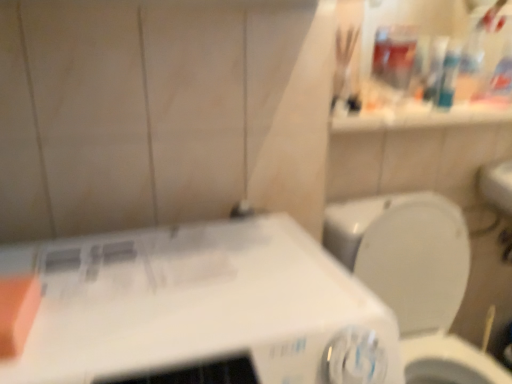
I want to click on vacant region to the right of orange matte soap at left, so click(x=114, y=318).